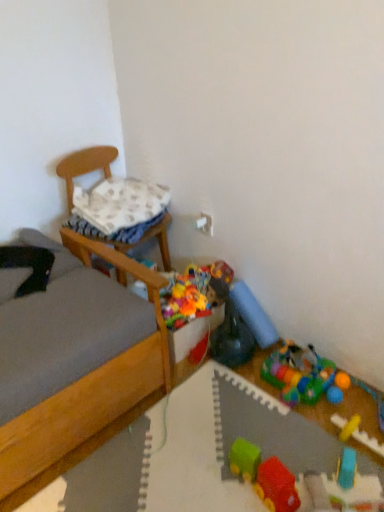
Locate an element on the screen. The width and height of the screenshot is (384, 512). vacant area situated below yellow rubber train at lower right, placed as the fifth toy when sorted from back to front (from a real-world perspective) is located at coordinates (364, 444).